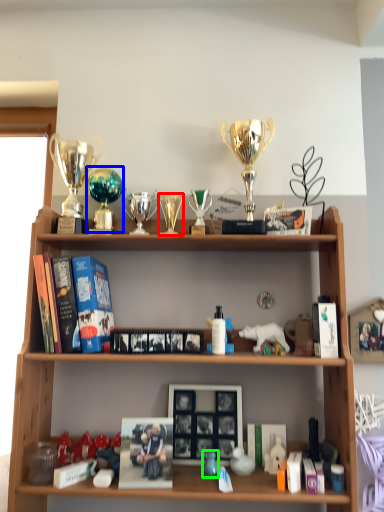
Question: Which object is positioned closest to candle holder (highlighted by a red box)? Select from trophy (highlighted by a blue box) and toy (highlighted by a green box).

Choices:
 (A) trophy
 (B) toy

Answer: (A)